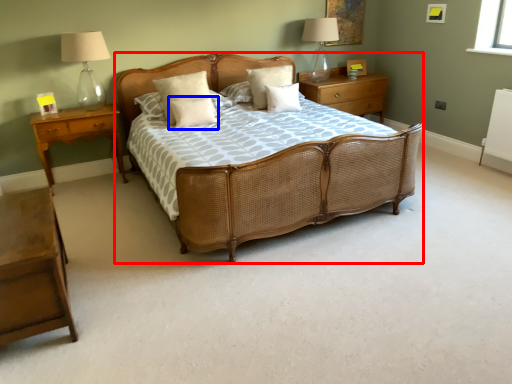
Question: Which point is closer to the camera, bed (highlighted by a red box) or pillow (highlighted by a blue box)?

Choices:
 (A) bed
 (B) pillow

Answer: (A)